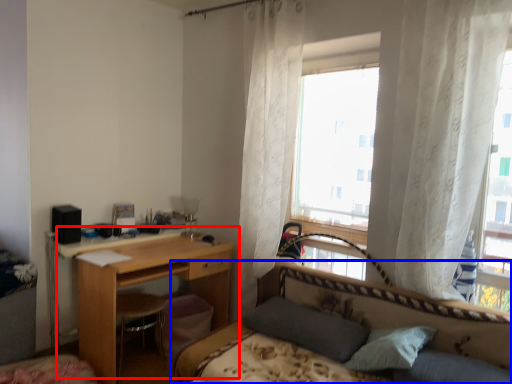
Question: Which of the following is the farthest to the observer, desk (highlighted by a red box) or bed (highlighted by a blue box)?

Choices:
 (A) desk
 (B) bed

Answer: (A)